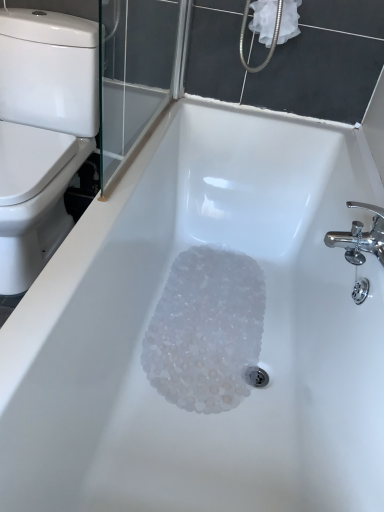
Question: Does white fabric at upper right turn towards white glossy toilet at left?

Choices:
 (A) yes
 (B) no

Answer: (B)

Question: Considering the relative positions of white fabric at upper right and white glossy toilet at left in the image provided, is white fabric at upper right to the left of white glossy toilet at left from the viewer's perspective?

Choices:
 (A) yes
 (B) no

Answer: (B)

Question: From a real-world perspective, is white fabric at upper right under white glossy toilet at left?

Choices:
 (A) yes
 (B) no

Answer: (B)

Question: Considering the relative sizes of white fabric at upper right and white glossy toilet at left in the image provided, is white fabric at upper right wider than white glossy toilet at left?

Choices:
 (A) no
 (B) yes

Answer: (A)

Question: Is white fabric at upper right facing away from white glossy toilet at left?

Choices:
 (A) no
 (B) yes

Answer: (A)

Question: Does white fabric at upper right come in front of white glossy toilet at left?

Choices:
 (A) yes
 (B) no

Answer: (B)

Question: Does translucent plastic crystals at bottom have a larger size compared to white glossy toilet at left?

Choices:
 (A) no
 (B) yes

Answer: (A)

Question: Is translucent plastic crystals at bottom in contact with white glossy toilet at left?

Choices:
 (A) yes
 (B) no

Answer: (B)

Question: Does translucent plastic crystals at bottom have a smaller size compared to white glossy toilet at left?

Choices:
 (A) yes
 (B) no

Answer: (A)

Question: From a real-world perspective, is translucent plastic crystals at bottom physically below white glossy toilet at left?

Choices:
 (A) yes
 (B) no

Answer: (A)

Question: Is translucent plastic crystals at bottom facing away from white glossy toilet at left?

Choices:
 (A) yes
 (B) no

Answer: (B)

Question: Is white glossy toilet at left inside translucent plastic crystals at bottom?

Choices:
 (A) no
 (B) yes

Answer: (A)

Question: Is white glossy toilet at left outside of white fabric at upper right?

Choices:
 (A) yes
 (B) no

Answer: (A)